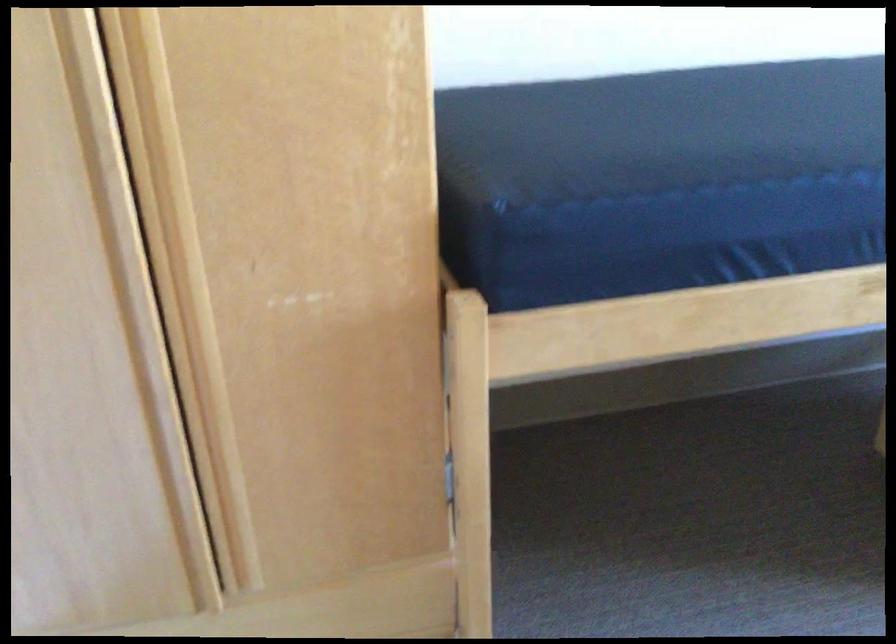
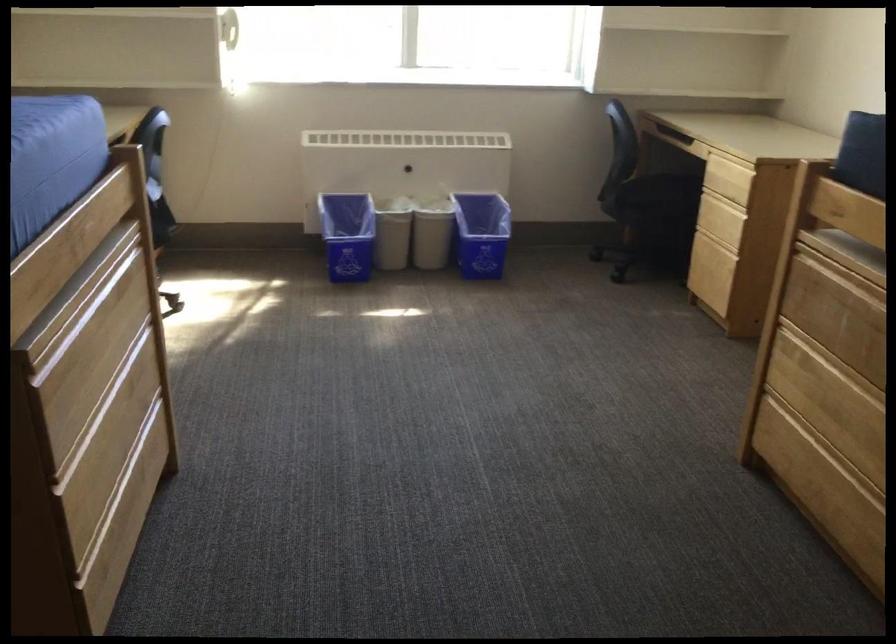
Based on the continuous images, in which direction is the camera rotating?

The rotation direction of the camera is right-down.